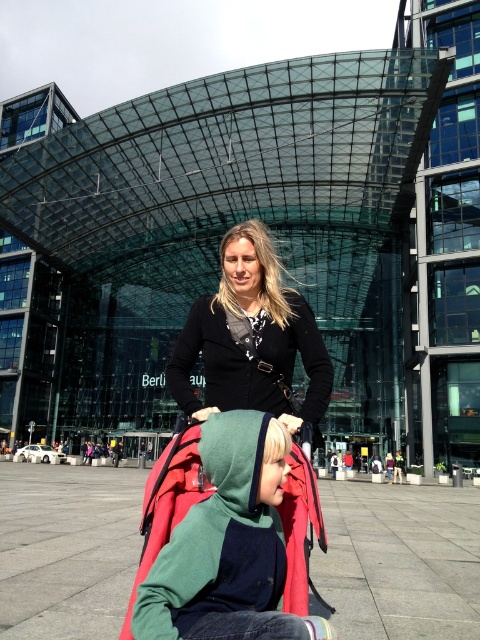
Question: Which object is farther from the camera taking this photo?

Choices:
 (A) green fleece jacket at center
 (B) black matte cardigan at center

Answer: (B)

Question: Is green fleece jacket at center to the left of black matte cardigan at center from the viewer's perspective?

Choices:
 (A) yes
 (B) no

Answer: (A)

Question: Where is green fleece jacket at center located in relation to black matte cardigan at center in the image?

Choices:
 (A) left
 (B) right

Answer: (A)

Question: From the image, what is the correct spatial relationship of green fleece jacket at center in relation to black matte cardigan at center?

Choices:
 (A) above
 (B) below

Answer: (B)